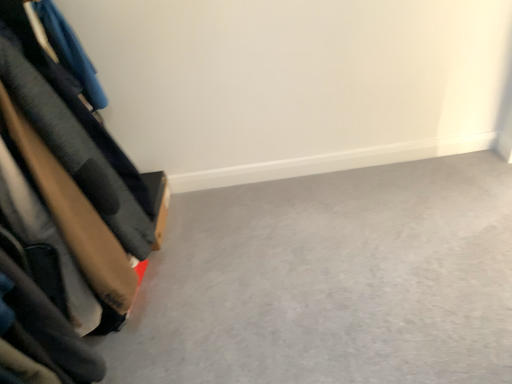
Describe the element at coordinates (331, 281) in the screenshot. This screenshot has width=512, height=384. I see `smooth gray carpet at lower left` at that location.

Find the location of a particular element. Image resolution: width=512 pixels, height=384 pixels. smooth gray carpet at lower left is located at coordinates (331, 281).

What is the approximate width of smooth gray carpet at lower left?

smooth gray carpet at lower left is 5.46 feet wide.

This screenshot has width=512, height=384. Describe the element at coordinates (63, 210) in the screenshot. I see `velvet-like fabric couch at left` at that location.

Locate an element on the screen. The width and height of the screenshot is (512, 384). velvet-like fabric couch at left is located at coordinates (63, 210).

Image resolution: width=512 pixels, height=384 pixels. I want to click on smooth gray carpet at lower left, so click(x=331, y=281).

Between velvet-like fabric couch at left and smooth gray carpet at lower left, which one appears on the left side from the viewer's perspective?

velvet-like fabric couch at left.

Who is more distant, velvet-like fabric couch at left or smooth gray carpet at lower left?

smooth gray carpet at lower left is more distant.

Is point (160, 199) closer or farther from the camera than point (315, 288)?

Point (160, 199).

From the image's perspective, which one is positioned lower, velvet-like fabric couch at left or smooth gray carpet at lower left?

smooth gray carpet at lower left appears lower in the image.

From a real-world perspective, is velvet-like fabric couch at left below smooth gray carpet at lower left?

Actually, velvet-like fabric couch at left is physically above smooth gray carpet at lower left in the real world.

Which object is thinner, velvet-like fabric couch at left or smooth gray carpet at lower left?

velvet-like fabric couch at left is thinner.

Considering the sizes of velvet-like fabric couch at left and smooth gray carpet at lower left in the image, is velvet-like fabric couch at left taller or shorter than smooth gray carpet at lower left?

Clearly, velvet-like fabric couch at left is taller compared to smooth gray carpet at lower left.

Is velvet-like fabric couch at left bigger or smaller than smooth gray carpet at lower left?

velvet-like fabric couch at left is bigger than smooth gray carpet at lower left.

Can smooth gray carpet at lower left be found inside velvet-like fabric couch at left?

Definitely not — smooth gray carpet at lower left is not inside velvet-like fabric couch at left.

Can you see velvet-like fabric couch at left touching smooth gray carpet at lower left?

There is a gap between velvet-like fabric couch at left and smooth gray carpet at lower left.

Is velvet-like fabric couch at left facing towards smooth gray carpet at lower left?

Yes, velvet-like fabric couch at left is turned towards smooth gray carpet at lower left.

Find the location of a particular element. This screenshot has height=384, width=512. furniture above the smooth gray carpet at lower left (from a real-world perspective) is located at coordinates (63, 210).

Which object is positioned more to the left, smooth gray carpet at lower left or velvet-like fabric couch at left?

velvet-like fabric couch at left.

Does smooth gray carpet at lower left come behind velvet-like fabric couch at left?

Yes, the depth of smooth gray carpet at lower left is greater than that of velvet-like fabric couch at left.

Is point (308, 275) positioned in front of point (13, 30)?

No, (308, 275) is behind (13, 30).

From the image's perspective, between smooth gray carpet at lower left and velvet-like fabric couch at left, who is located below?

smooth gray carpet at lower left, from the image's perspective.

From a real-world perspective, is smooth gray carpet at lower left over velvet-like fabric couch at left?

Actually, smooth gray carpet at lower left is physically below velvet-like fabric couch at left in the real world.

Considering the relative sizes of smooth gray carpet at lower left and velvet-like fabric couch at left in the image provided, is smooth gray carpet at lower left wider than velvet-like fabric couch at left?

Correct, the width of smooth gray carpet at lower left exceeds that of velvet-like fabric couch at left.

Who is shorter, smooth gray carpet at lower left or velvet-like fabric couch at left?

Standing shorter between the two is smooth gray carpet at lower left.

Which of these two, smooth gray carpet at lower left or velvet-like fabric couch at left, is bigger?

velvet-like fabric couch at left.

Is velvet-like fabric couch at left located within smooth gray carpet at lower left?

No, velvet-like fabric couch at left is not a part of smooth gray carpet at lower left.

Would you say smooth gray carpet at lower left is a long distance from velvet-like fabric couch at left?

Actually, smooth gray carpet at lower left and velvet-like fabric couch at left are a little close together.

Is velvet-like fabric couch at left at the back of smooth gray carpet at lower left?

smooth gray carpet at lower left is not turned away from velvet-like fabric couch at left.

Where is `furniture in front of the smooth gray carpet at lower left`? furniture in front of the smooth gray carpet at lower left is located at coordinates click(x=63, y=210).

Locate an element on the screen. The width and height of the screenshot is (512, 384). furniture above the smooth gray carpet at lower left (from a real-world perspective) is located at coordinates (63, 210).

Image resolution: width=512 pixels, height=384 pixels. I want to click on furniture on the left of smooth gray carpet at lower left, so click(x=63, y=210).